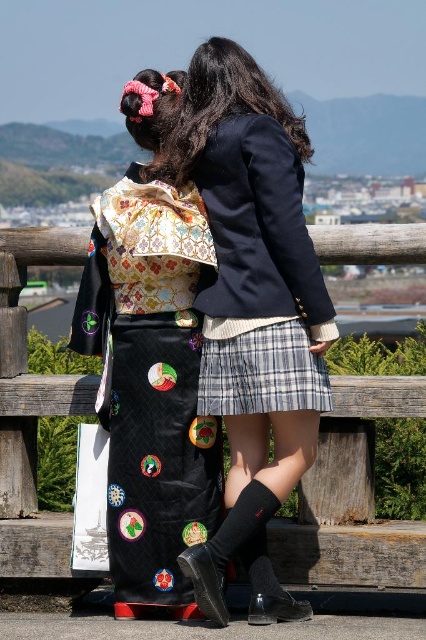
Question: Is matte black blazer at center below black quilted kimono at center?

Choices:
 (A) yes
 (B) no

Answer: (B)

Question: Which point is farther from the camera taking this photo?

Choices:
 (A) (216, 468)
 (B) (299, 372)
 (C) (293, 451)
 (D) (198, 584)

Answer: (A)

Question: Which of the following is the farthest from the observer?

Choices:
 (A) matte black blazer at center
 (B) black quilted kimono at center
 (C) black leather boot at lower center

Answer: (B)

Question: Can you confirm if black quilted kimono at center is wider than plaid fabric skirt at center?

Choices:
 (A) no
 (B) yes

Answer: (B)

Question: Which of the following is the closest to the observer?

Choices:
 (A) (267, 340)
 (B) (198, 584)
 (C) (249, 332)

Answer: (B)

Question: Is black quilted kimono at center above plaid fabric skirt at center?

Choices:
 (A) no
 (B) yes

Answer: (B)